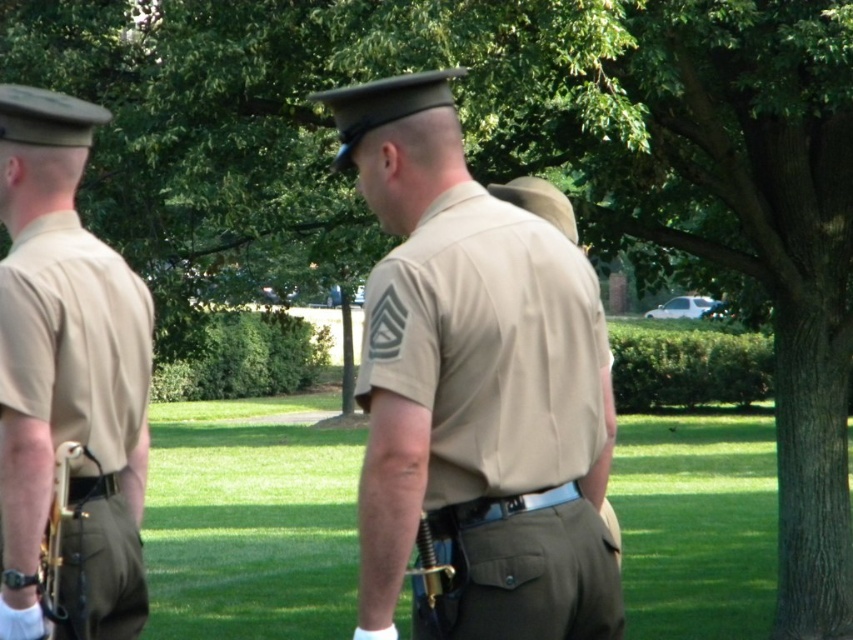
Is tan fabric shirt at center bigger than matte khaki uniform at left?

Indeed, tan fabric shirt at center has a larger size compared to matte khaki uniform at left.

Is tan fabric shirt at center closer to camera compared to matte khaki uniform at left?

Yes, it is.

Describe the element at coordinates (486, 422) in the screenshot. The width and height of the screenshot is (853, 640). I see `tan fabric shirt at center` at that location.

At what (x,y) coordinates should I click in order to perform the action: click on tan fabric shirt at center. Please return your answer as a coordinate pair (x, y). The width and height of the screenshot is (853, 640). Looking at the image, I should click on (486, 422).